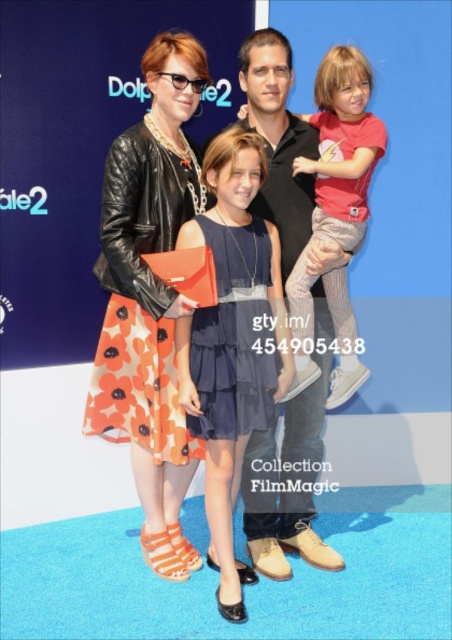
Question: Which of the following is the closest to the observer?

Choices:
 (A) leather jacket at center
 (B) matte black jacket at center

Answer: (A)

Question: Which of these objects is positioned farthest from the leather jacket at center?

Choices:
 (A) red cotton shirt at upper right
 (B) suede black shirt at center

Answer: (A)

Question: Does leather jacket at center have a smaller size compared to red cotton shirt at upper right?

Choices:
 (A) yes
 (B) no

Answer: (B)

Question: Which object is positioned farthest from the suede black shirt at center?

Choices:
 (A) orange floral dress at center
 (B) matte black jacket at center
 (C) red cotton shirt at upper right

Answer: (A)

Question: Can you confirm if leather jacket at center is positioned to the right of red cotton shirt at upper right?

Choices:
 (A) yes
 (B) no

Answer: (B)

Question: Can you confirm if leather jacket at center is bigger than suede black shirt at center?

Choices:
 (A) yes
 (B) no

Answer: (A)